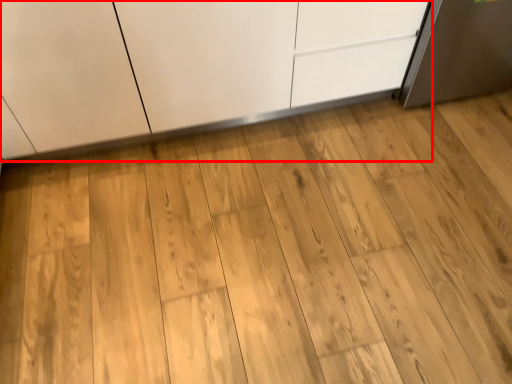
Question: From the image's perspective, considering the relative positions of cabinetry (annotated by the red box) and dresser in the image provided, where is cabinetry (annotated by the red box) located with respect to the staircase?

Choices:
 (A) above
 (B) below

Answer: (A)